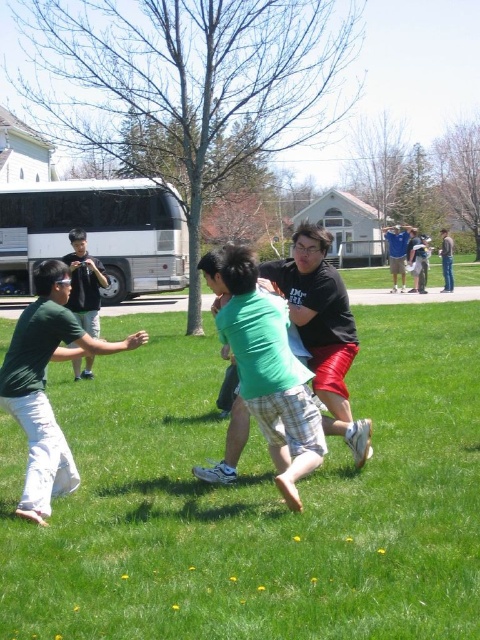
In the park scene, there are two people wearing shirts labeled as the green cotton shirt at center and the blue fabric shirt at center. Which of these two shirts is taking up more space in the image?

The blue fabric shirt at center occupies more space than the green cotton shirt at center according to the description.

You are a photographer standing in the park and want to capture a photo of the blue fabric shirt at center and the denim jeans at right. Which object should you focus on first if you want to include both in your shot without moving the camera?

The blue fabric shirt at center is much taller than the denim jeans at right, so you should focus on the blue fabric shirt at center first to ensure it fits within the frame.

You are standing at the point marked by the coordinates point (255, 500) in the image. What is the terrain like under your feet?

The terrain under your feet at point (255, 500) is green grass at center.